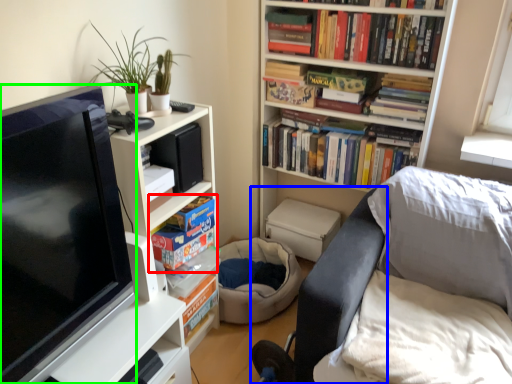
Question: Considering the real-world distances, which object is closest to book (highlighted by a red box)? swivel chair (highlighted by a blue box) or television (highlighted by a green box).

Choices:
 (A) swivel chair
 (B) television

Answer: (B)